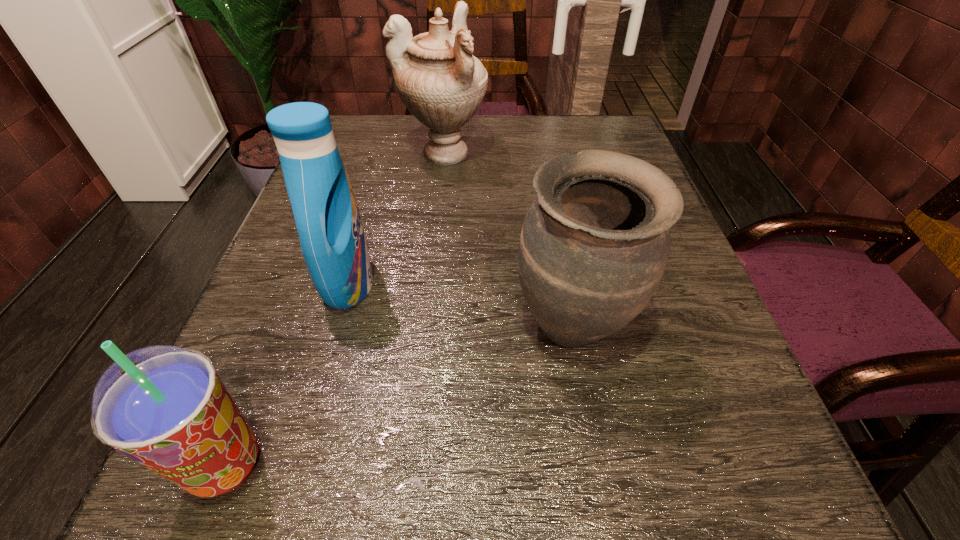
The image size is (960, 540). I want to click on object located at the far edge, so click(441, 83).

You are a GUI agent. You are given a task and a screenshot of the screen. Output one action in this format:
    pyautogui.click(x=<x>, y=<y>)
    Task: Click on the object located at the near edge
    The image size is (960, 540).
    Given the screenshot: What is the action you would take?
    pyautogui.click(x=165, y=407)

Identify the location of detergent present at the left edge. The image size is (960, 540). (333, 243).

What are the coordinates of `smoothie that is at the left edge` in the screenshot? It's located at (165, 407).

This screenshot has height=540, width=960. In order to click on object present at the right edge in this screenshot , I will do `click(594, 245)`.

Where is `object that is positioned at the near left corner`? object that is positioned at the near left corner is located at coordinates (165, 407).

What are the coordinates of `free space at the far edge of the desktop` in the screenshot? It's located at (495, 159).

In the image, there is a desktop. At what (x,y) coordinates should I click in order to perform the action: click on vacant space at the near edge. Please return your answer as a coordinate pair (x, y). This screenshot has width=960, height=540. Looking at the image, I should click on (304, 538).

Identify the location of free space at the left edge. This screenshot has height=540, width=960. (286, 330).

In order to click on vacant space at the right edge of the desktop in this screenshot , I will do `click(684, 264)`.